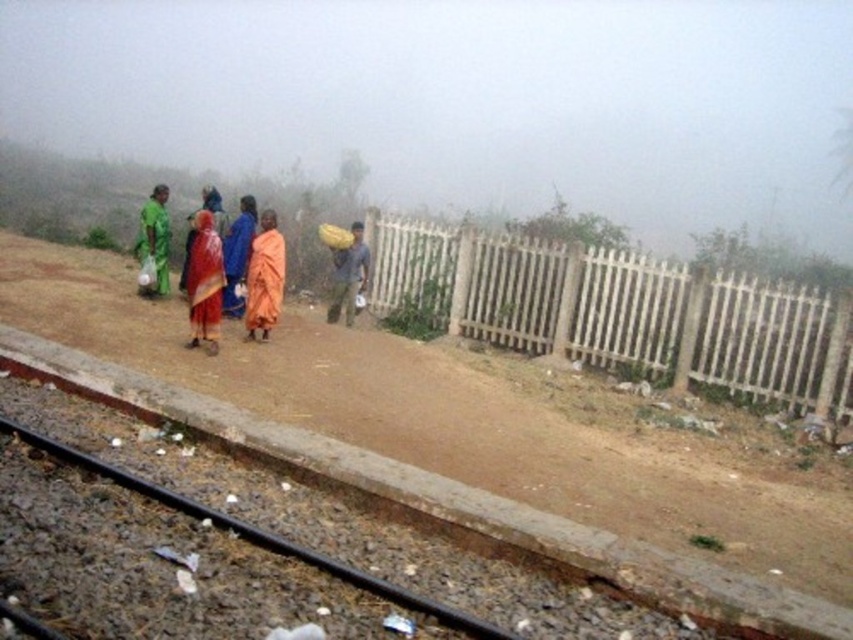
Question: Among these objects, which one is nearest to the camera?

Choices:
 (A) black rubber track at lower left
 (B) brown fabric bag at center
 (C) white wooden fence at center
 (D) orange fabric at center

Answer: (A)

Question: Can you confirm if matte orange cloth at center is positioned above brown fabric bag at center?

Choices:
 (A) yes
 (B) no

Answer: (B)

Question: Is white wooden fence at center behind black rubber track at lower left?

Choices:
 (A) yes
 (B) no

Answer: (A)

Question: Does white wooden fence at center have a larger size compared to matte orange cloth at center?

Choices:
 (A) no
 (B) yes

Answer: (B)

Question: Which object is closer to the camera taking this photo?

Choices:
 (A) white wooden fence at center
 (B) brown fabric bag at center

Answer: (A)

Question: Which object is farther from the camera taking this photo?

Choices:
 (A) white wooden fence at center
 (B) brown fabric bag at center

Answer: (B)